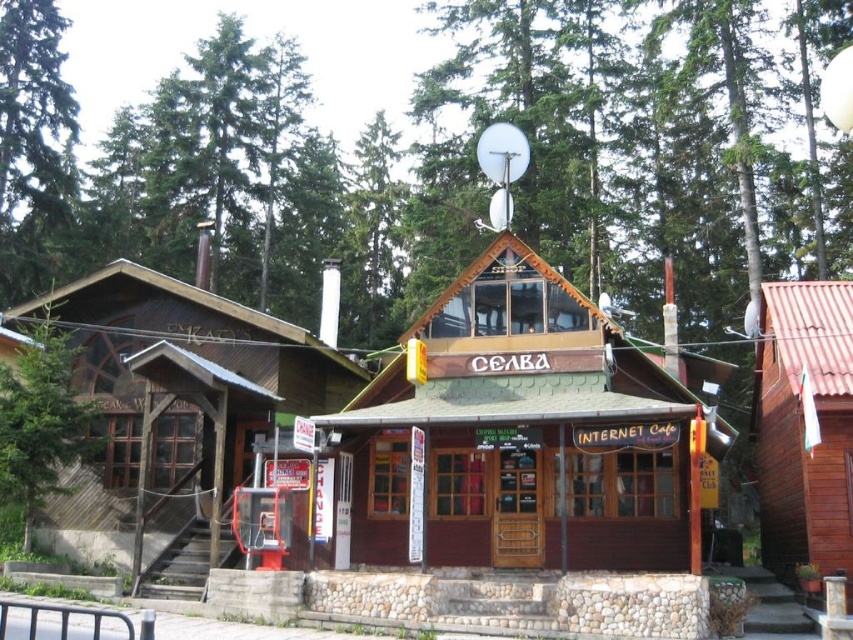
You are standing in front of the wooden building and notice two points marked on the image. The first point is at coordinate point (x=120, y=528) and the second is at point (x=851, y=544). Which of these points is closer to your current position?

Point (x=120, y=528) is closer to your current position because it is further to the camera than point (x=851, y=544).